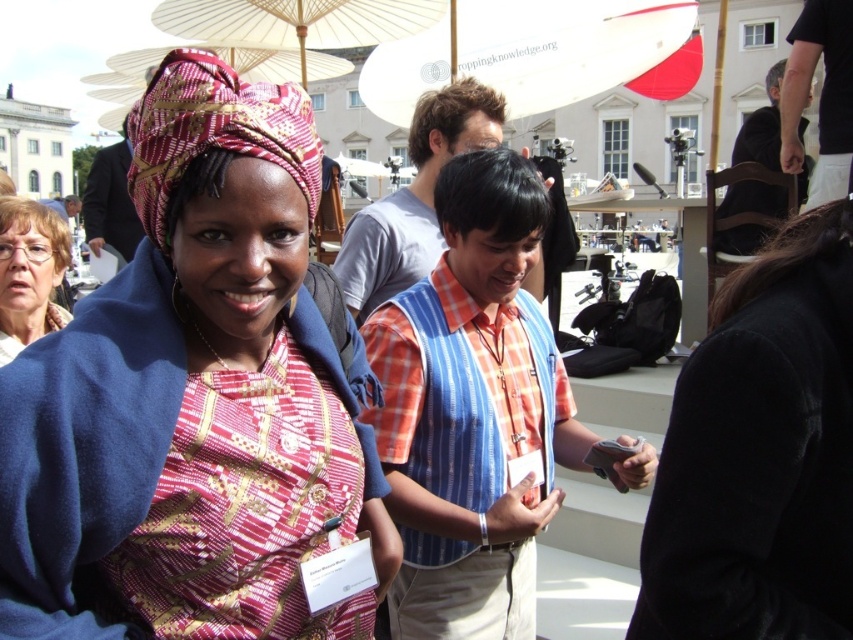
You are attending an outdoor event and need to stay dry during a sudden rain shower. You have a white matte umbrella at upper center and a printed fabric headscarf at center. Which item would provide better protection from the rain?

The white matte umbrella at upper center is bigger than the printed fabric headscarf at center, so it would provide better protection from the rain.

You are attending an outdoor event and notice a white paper umbrella at upper center and matte black glasses at upper left. Which object is positioned more to the east in the image?

The white paper umbrella at upper center is positioned more to the east than the matte black glasses at upper left.

You are a photographer taking a portrait of the two people in the scene. You notice the matte fabric headscarf at upper left and the matte black glasses at upper left. Which object should you focus on first if you want to capture the larger object in your frame?

The matte fabric headscarf at upper left is larger than the matte black glasses at upper left, so you should focus on the matte fabric headscarf at upper left first to capture the larger object in your frame.